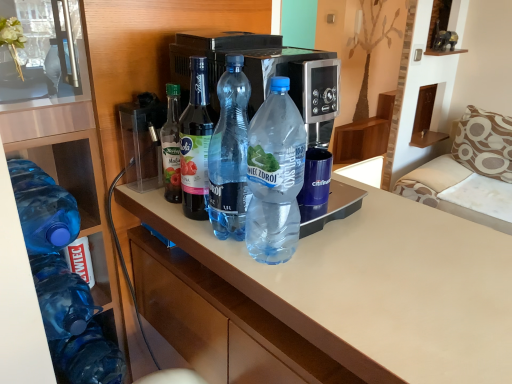
Question: Considering the relative sizes of transparent plastic container at upper left and blue translucent bottle at left, the 5th bottle viewed from the right, in the image provided, is transparent plastic container at upper left wider than blue translucent bottle at left, the 5th bottle viewed from the right,?

Choices:
 (A) no
 (B) yes

Answer: (A)

Question: Is transparent plastic container at upper left with blue translucent bottle at left, the 5th bottle viewed from the right?

Choices:
 (A) yes
 (B) no

Answer: (B)

Question: Considering the relative positions of transparent plastic container at upper left and blue translucent bottle at left, the 5th bottle viewed from the right, in the image provided, is transparent plastic container at upper left to the left of blue translucent bottle at left, the 5th bottle viewed from the right, from the viewer's perspective?

Choices:
 (A) no
 (B) yes

Answer: (A)

Question: From the image's perspective, would you say transparent plastic container at upper left is shown under blue translucent bottle at left, the 5th bottle viewed from the right?

Choices:
 (A) yes
 (B) no

Answer: (B)

Question: Could you tell me if transparent plastic container at upper left is facing blue translucent bottle at left, the 1th bottle in the left-to-right sequence?

Choices:
 (A) no
 (B) yes

Answer: (A)

Question: Does transparent plastic container at upper left have a lesser width compared to blue translucent bottle at left, the 5th bottle viewed from the right?

Choices:
 (A) yes
 (B) no

Answer: (A)

Question: Are beige fabric sofa at right and translucent plastic bottles at center far apart?

Choices:
 (A) no
 (B) yes

Answer: (B)

Question: From the image's perspective, is beige fabric sofa at right over translucent plastic bottles at center?

Choices:
 (A) no
 (B) yes

Answer: (B)

Question: Could you tell me if beige fabric sofa at right is turned towards translucent plastic bottles at center?

Choices:
 (A) yes
 (B) no

Answer: (A)

Question: Is beige fabric sofa at right closer to the viewer compared to translucent plastic bottles at center?

Choices:
 (A) yes
 (B) no

Answer: (B)

Question: Is beige fabric sofa at right not within translucent plastic bottles at center?

Choices:
 (A) no
 (B) yes

Answer: (B)

Question: Considering the relative positions of beige fabric sofa at right and translucent plastic bottles at center in the image provided, is beige fabric sofa at right to the right of translucent plastic bottles at center from the viewer's perspective?

Choices:
 (A) yes
 (B) no

Answer: (A)

Question: From the image's perspective, would you say blue translucent bottle at left, the 5th bottle viewed from the right, is shown under transparent plastic bottle at center, the 4th bottle when ordered from left to right?

Choices:
 (A) yes
 (B) no

Answer: (A)